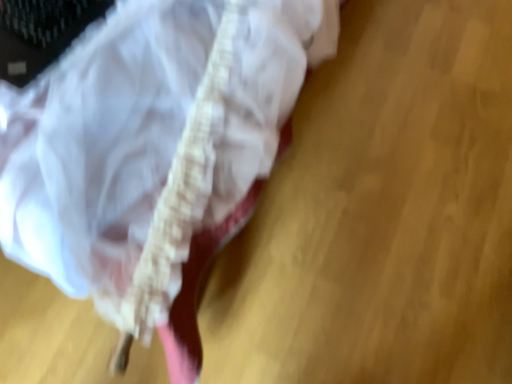
I want to click on translucent white plastic bag at upper left, so pyautogui.click(x=100, y=145).

This screenshot has height=384, width=512. What do you see at coordinates (100, 145) in the screenshot? I see `translucent white plastic bag at upper left` at bounding box center [100, 145].

What is the approximate width of translucent white plastic bag at upper left?

3.93 feet.

Identify the location of translucent white plastic bag at upper left. (100, 145).